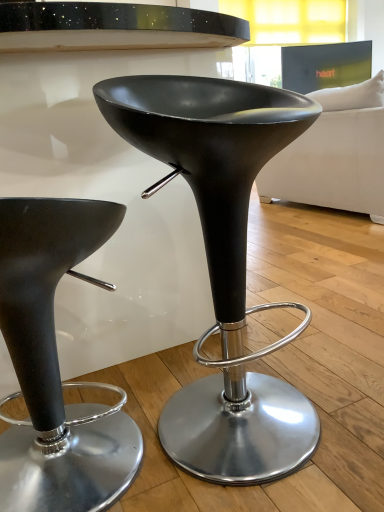
The width and height of the screenshot is (384, 512). What do you see at coordinates (335, 154) in the screenshot?
I see `white fabric couch at upper right` at bounding box center [335, 154].

This screenshot has height=512, width=384. In order to click on white fabric couch at upper right in this screenshot , I will do `click(335, 154)`.

Which of these two, matte black stool at center, which is the first stool from right to left, or white fabric couch at upper right, is smaller?

Smaller between the two is matte black stool at center, which is the first stool from right to left.

How different are the orientations of matte black stool at center, positioned as the 2th stool in left-to-right order, and white fabric couch at upper right in degrees?

The angular difference between matte black stool at center, positioned as the 2th stool in left-to-right order, and white fabric couch at upper right is 68 degrees.

Considering the points (241, 87) and (346, 206), which point is in front, point (241, 87) or point (346, 206)?

Positioned in front is point (241, 87).

Does matte black stool at center, which is the first stool from right to left, have a greater height compared to white fabric couch at upper right?

Incorrect, the height of matte black stool at center, which is the first stool from right to left, is not larger of that of white fabric couch at upper right.

Which of these two, white fabric couch at upper right or matte black stool at center, positioned as the 2th stool in left-to-right order, stands shorter?

Standing shorter between the two is matte black stool at center, positioned as the 2th stool in left-to-right order.

Is white fabric couch at upper right oriented away from matte black stool at center, positioned as the 2th stool in left-to-right order?

No, white fabric couch at upper right is not facing away from matte black stool at center, positioned as the 2th stool in left-to-right order.

From a real-world perspective, is white fabric couch at upper right positioned above or below matte black stool at center, which is the first stool from right to left?

white fabric couch at upper right is situated higher than matte black stool at center, which is the first stool from right to left, in the real world.

Are white fabric couch at upper right and matte black stool at center, which is the first stool from right to left, making contact?

No, white fabric couch at upper right is not with matte black stool at center, which is the first stool from right to left.

Considering the sizes of objects matte black stool at center, the second stool in the right-to-left sequence, and matte black stool at center, positioned as the 2th stool in left-to-right order, in the image provided, who is smaller, matte black stool at center, the second stool in the right-to-left sequence, or matte black stool at center, positioned as the 2th stool in left-to-right order,?

Smaller between the two is matte black stool at center, the second stool in the right-to-left sequence.

From a real-world perspective, is matte black stool at center, the second stool in the right-to-left sequence, physically below matte black stool at center, positioned as the 2th stool in left-to-right order?

Indeed, from a real-world perspective, matte black stool at center, the second stool in the right-to-left sequence, is positioned beneath matte black stool at center, positioned as the 2th stool in left-to-right order.

Is matte black stool at center, the 1th stool in the left-to-right sequence, facing away from matte black stool at center, positioned as the 2th stool in left-to-right order?

Result: No, matte black stool at center, the 1th stool in the left-to-right sequence, is not facing the opposite direction of matte black stool at center, positioned as the 2th stool in left-to-right order.

Is matte black stool at center, the 1th stool in the left-to-right sequence, not inside matte black stool at center, which is the first stool from right to left?

matte black stool at center, the 1th stool in the left-to-right sequence, is positioned outside matte black stool at center, which is the first stool from right to left.

How distant is matte black stool at center, positioned as the 2th stool in left-to-right order, from matte black stool at center, the second stool in the right-to-left sequence?

matte black stool at center, positioned as the 2th stool in left-to-right order, is 9.79 inches away from matte black stool at center, the second stool in the right-to-left sequence.

Is the depth of matte black stool at center, which is the first stool from right to left, greater than that of matte black stool at center, the second stool in the right-to-left sequence?

No, it is not.

Considering the relative sizes of matte black stool at center, positioned as the 2th stool in left-to-right order, and matte black stool at center, the 1th stool in the left-to-right sequence, in the image provided, is matte black stool at center, positioned as the 2th stool in left-to-right order, wider than matte black stool at center, the 1th stool in the left-to-right sequence,?

Yes, matte black stool at center, positioned as the 2th stool in left-to-right order, is wider than matte black stool at center, the 1th stool in the left-to-right sequence.

Find the location of `stool on the right of matte black stool at center, the second stool in the right-to-left sequence`. stool on the right of matte black stool at center, the second stool in the right-to-left sequence is located at coordinates (222, 264).

Which of these two, matte black stool at center, the second stool in the right-to-left sequence, or white fabric couch at upper right, is wider?

With larger width is white fabric couch at upper right.

Is matte black stool at center, the 1th stool in the left-to-right sequence, further to the viewer compared to white fabric couch at upper right?

No, it is not.

Considering the sizes of objects matte black stool at center, the second stool in the right-to-left sequence, and white fabric couch at upper right in the image provided, who is smaller, matte black stool at center, the second stool in the right-to-left sequence, or white fabric couch at upper right?

With smaller size is matte black stool at center, the second stool in the right-to-left sequence.

Is white fabric couch at upper right to the left of matte black stool at center, the second stool in the right-to-left sequence, from the viewer's perspective?

No.

Which is correct: white fabric couch at upper right is inside matte black stool at center, the 1th stool in the left-to-right sequence, or outside of it?

white fabric couch at upper right is outside matte black stool at center, the 1th stool in the left-to-right sequence.

Would you say white fabric couch at upper right is a long distance from matte black stool at center, the 1th stool in the left-to-right sequence?

Yes.

Is white fabric couch at upper right in front of or behind matte black stool at center, the 1th stool in the left-to-right sequence, in the image?

white fabric couch at upper right is behind matte black stool at center, the 1th stool in the left-to-right sequence.

The image size is (384, 512). In order to click on stool that is the 2nd object located in front of the white fabric couch at upper right in this screenshot , I will do `click(222, 264)`.

Where is `the 1st stool positioned below the white fabric couch at upper right (from a real-world perspective)`? This screenshot has width=384, height=512. the 1st stool positioned below the white fabric couch at upper right (from a real-world perspective) is located at coordinates (222, 264).

Estimate the real-world distances between objects in this image. Which object is closer to matte black stool at center, positioned as the 2th stool in left-to-right order, white fabric couch at upper right or matte black stool at center, the second stool in the right-to-left sequence?

matte black stool at center, the second stool in the right-to-left sequence.

Considering their positions, is matte black stool at center, the 1th stool in the left-to-right sequence, positioned further to white fabric couch at upper right than matte black stool at center, which is the first stool from right to left?

Based on the image, matte black stool at center, the 1th stool in the left-to-right sequence, appears to be further to white fabric couch at upper right.

Looking at the image, which one is located further to matte black stool at center, the second stool in the right-to-left sequence, white fabric couch at upper right or matte black stool at center, positioned as the 2th stool in left-to-right order?

Based on the image, white fabric couch at upper right appears to be further to matte black stool at center, the second stool in the right-to-left sequence.

Looking at the image, which one is located further to matte black stool at center, the 1th stool in the left-to-right sequence, matte black stool at center, positioned as the 2th stool in left-to-right order, or white fabric couch at upper right?

white fabric couch at upper right.

Which object lies nearer to the anchor point white fabric couch at upper right, matte black stool at center, which is the first stool from right to left, or matte black stool at center, the 1th stool in the left-to-right sequence?

matte black stool at center, which is the first stool from right to left, is closer to white fabric couch at upper right.

Estimate the real-world distances between objects in this image. Which object is further from matte black stool at center, which is the first stool from right to left, matte black stool at center, the second stool in the right-to-left sequence, or white fabric couch at upper right?

Based on the image, white fabric couch at upper right appears to be further to matte black stool at center, which is the first stool from right to left.

This screenshot has height=512, width=384. I want to click on stool between matte black stool at center, positioned as the 2th stool in left-to-right order, and white fabric couch at upper right, along the z-axis, so pos(56,366).